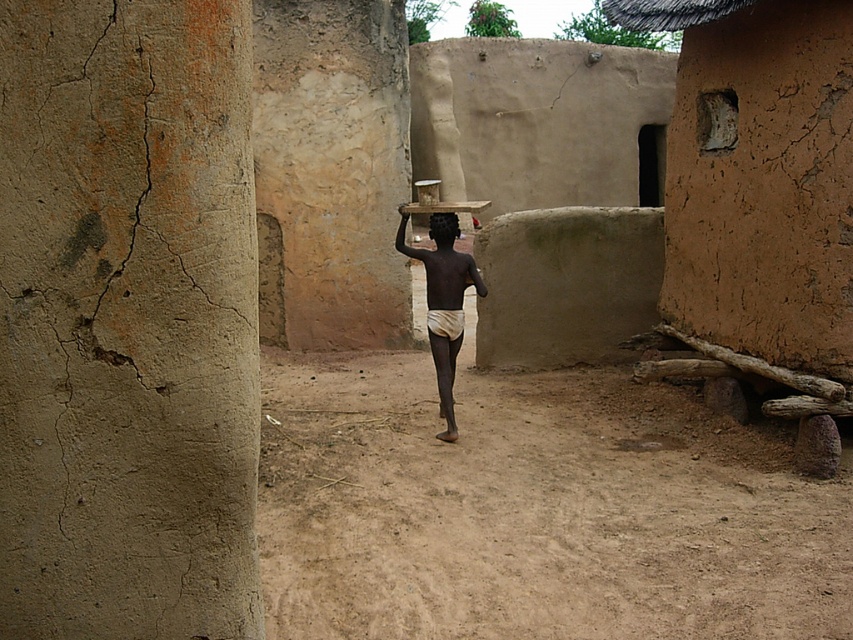
Question: Does light beige cloth at center have a lesser width compared to black matte head at center?

Choices:
 (A) yes
 (B) no

Answer: (B)

Question: Which point is closer to the camera?

Choices:
 (A) (451, 248)
 (B) (444, 227)

Answer: (B)

Question: Among these points, which one is nearest to the camera?

Choices:
 (A) (440, 228)
 (B) (457, 301)

Answer: (B)

Question: Among these objects, which one is farthest from the camera?

Choices:
 (A) black matte head at center
 (B) light beige cloth at center

Answer: (A)

Question: Does light beige cloth at center appear under black matte head at center?

Choices:
 (A) no
 (B) yes

Answer: (B)

Question: Does light beige cloth at center have a larger size compared to black matte head at center?

Choices:
 (A) no
 (B) yes

Answer: (A)